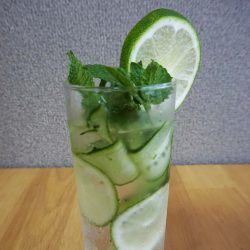
At what (x,y) coordinates should I click in order to perform the action: click on glass. Please return your answer as a coordinate pair (x, y). Looking at the image, I should click on (126, 187).